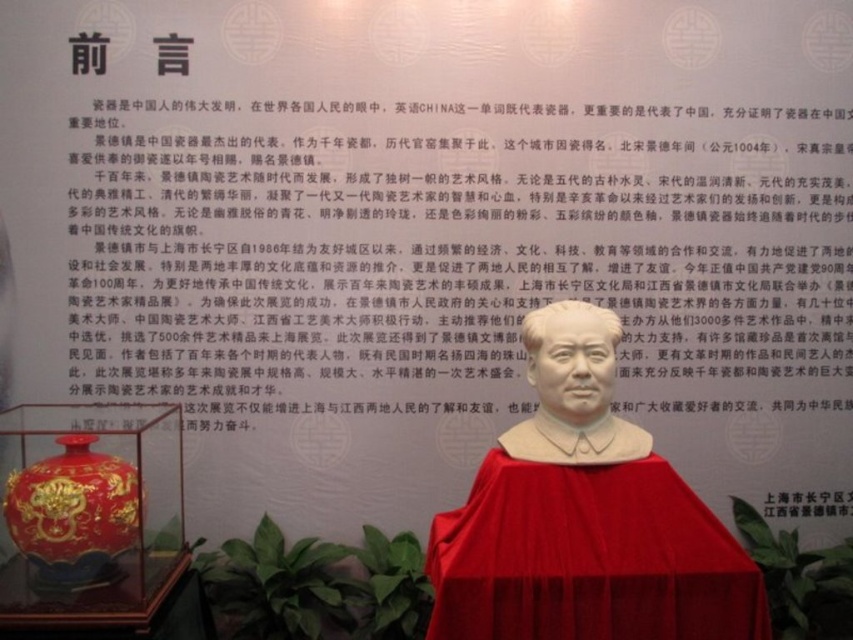
You are an art student who wants to take a photo of the white glossy statue at center and the matte gray bust at center. Which one will appear larger in your camera viewfinder?

The white glossy statue at center will appear larger in the camera viewfinder because it is closer to the viewer than the matte gray bust at center.

You are an art curator planning to move the white glossy statue at center and the matte gray bust at center to a new exhibition space. The new space has a height restriction of 2 meters. Can both objects be moved without any adjustments?

The white glossy statue at center is positioned under the matte gray bust at center. Since the total height of both objects combined would exceed the 2 meter restriction, adjustments are needed to ensure they can be moved safely.